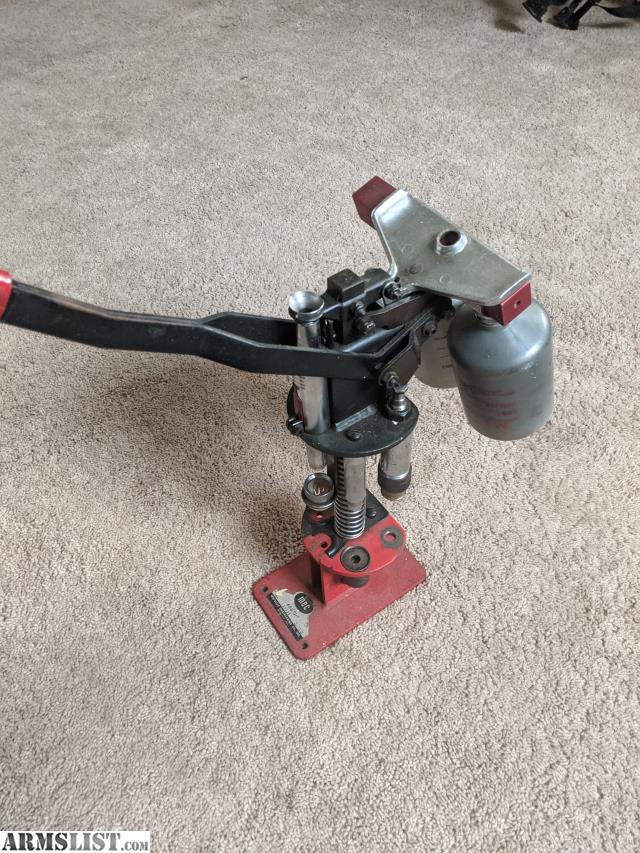
At what (x,y) coordinates should I click in order to perform the action: click on carpet. Please return your answer as a coordinate pair (x, y). Looking at the image, I should click on (203, 32).